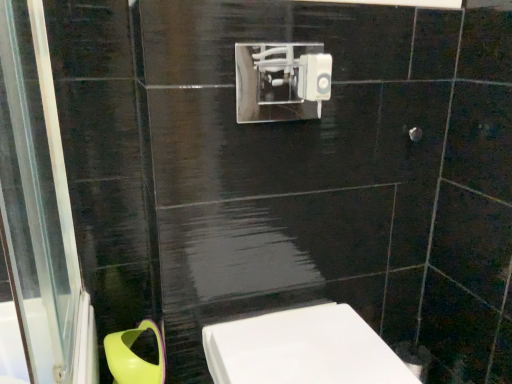
Question: Is point 125,354 closer or farther from the camera than point 362,365?

Choices:
 (A) closer
 (B) farther

Answer: (B)

Question: From their relative heights in the image, would you say green plastic toilet bowl at lower left is taller or shorter than white glossy toilet at lower center?

Choices:
 (A) short
 (B) tall

Answer: (A)

Question: In the image, is green plastic toilet bowl at lower left positioned in front of or behind white glossy toilet at lower center?

Choices:
 (A) front
 (B) behind

Answer: (B)

Question: Considering the positions of white glossy toilet at lower center and green plastic toilet bowl at lower left in the image, is white glossy toilet at lower center bigger or smaller than green plastic toilet bowl at lower left?

Choices:
 (A) small
 (B) big

Answer: (B)

Question: Visually, is white glossy toilet at lower center positioned to the left or to the right of green plastic toilet bowl at lower left?

Choices:
 (A) left
 (B) right

Answer: (B)

Question: Which is correct: white glossy toilet at lower center is inside green plastic toilet bowl at lower left, or outside of it?

Choices:
 (A) outside
 (B) inside

Answer: (A)

Question: Is white glossy toilet at lower center wider or thinner than green plastic toilet bowl at lower left?

Choices:
 (A) wide
 (B) thin

Answer: (A)